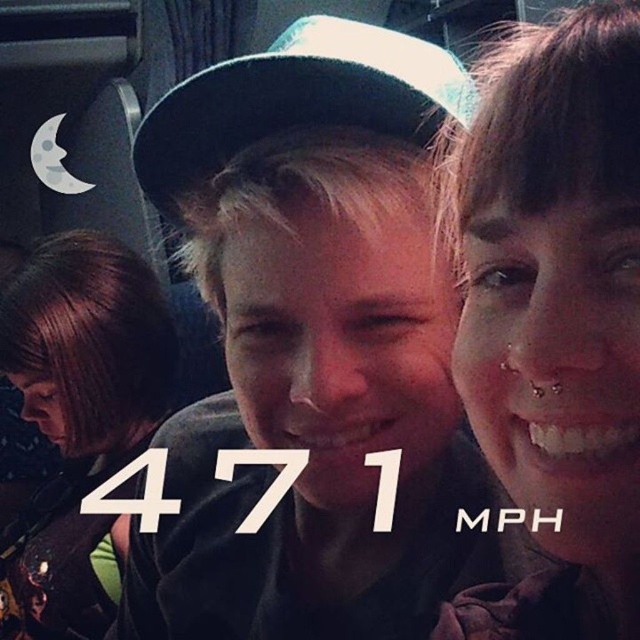
Does matte skin at center have a smaller size compared to green fabric baseball cap at center?

No.

Does matte skin at center appear on the left side of green fabric baseball cap at center?

No, matte skin at center is not to the left of green fabric baseball cap at center.

Does point (602, 593) come farther from viewer compared to point (212, 138)?

No, (602, 593) is closer to viewer.

Locate an element on the screen. The image size is (640, 640). matte skin at center is located at coordinates (554, 317).

Is point (266, 220) closer to viewer compared to point (60, 316)?

Yes, it is.

Is matte black hat at center positioned behind brown hair at lower left?

No, it is not.

Describe the element at coordinates (314, 346) in the screenshot. The image size is (640, 640). I see `matte black hat at center` at that location.

Where is `matte black hat at center`? The image size is (640, 640). matte black hat at center is located at coordinates tap(314, 346).

Does matte skin at center appear on the left side of brown hair at lower left?

No, matte skin at center is not to the left of brown hair at lower left.

Is matte skin at center positioned before brown hair at lower left?

Yes, matte skin at center is in front of brown hair at lower left.

Is point (502, 428) in front of point (141, 387)?

That is True.

In order to click on matte skin at center in this screenshot , I will do `click(554, 317)`.